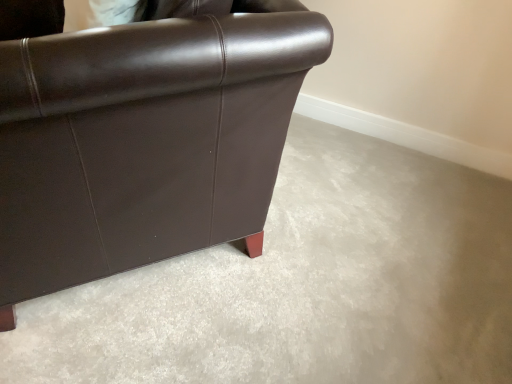
Question: Is brown leather couch at left positioned in front of matte brown leather chair at upper left?

Choices:
 (A) no
 (B) yes

Answer: (A)

Question: Considering the relative sizes of brown leather couch at left and matte brown leather chair at upper left in the image provided, is brown leather couch at left wider than matte brown leather chair at upper left?

Choices:
 (A) yes
 (B) no

Answer: (A)

Question: Considering the relative sizes of brown leather couch at left and matte brown leather chair at upper left in the image provided, is brown leather couch at left taller than matte brown leather chair at upper left?

Choices:
 (A) no
 (B) yes

Answer: (A)

Question: From a real-world perspective, is brown leather couch at left below matte brown leather chair at upper left?

Choices:
 (A) yes
 (B) no

Answer: (A)

Question: Is brown leather couch at left touching matte brown leather chair at upper left?

Choices:
 (A) no
 (B) yes

Answer: (A)

Question: From the image's perspective, is brown leather couch at left under matte brown leather chair at upper left?

Choices:
 (A) yes
 (B) no

Answer: (A)

Question: Is matte brown leather chair at upper left positioned behind brown leather couch at left?

Choices:
 (A) no
 (B) yes

Answer: (A)

Question: Is matte brown leather chair at upper left at the right side of brown leather couch at left?

Choices:
 (A) no
 (B) yes

Answer: (A)

Question: Is brown leather couch at left surrounded by matte brown leather chair at upper left?

Choices:
 (A) yes
 (B) no

Answer: (B)

Question: Can you confirm if matte brown leather chair at upper left is thinner than brown leather couch at left?

Choices:
 (A) no
 (B) yes

Answer: (B)

Question: From a real-world perspective, is matte brown leather chair at upper left over brown leather couch at left?

Choices:
 (A) yes
 (B) no

Answer: (A)

Question: Is matte brown leather chair at upper left closer to camera compared to brown leather couch at left?

Choices:
 (A) yes
 (B) no

Answer: (A)

Question: From a real-world perspective, is brown leather couch at left above or below matte brown leather chair at upper left?

Choices:
 (A) above
 (B) below

Answer: (B)